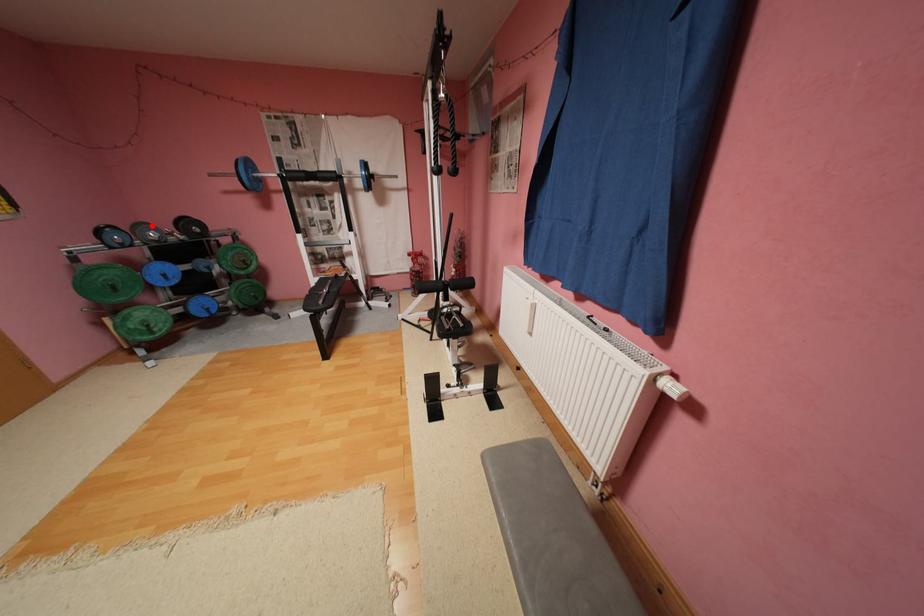
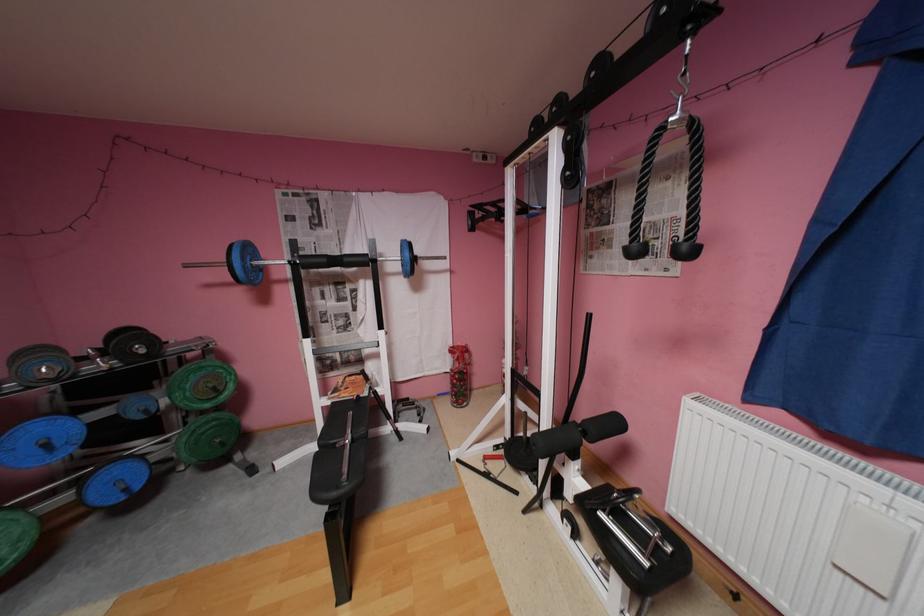
Where in the second image is the point corresponding to the highlighted location from the first image?

(49, 351)